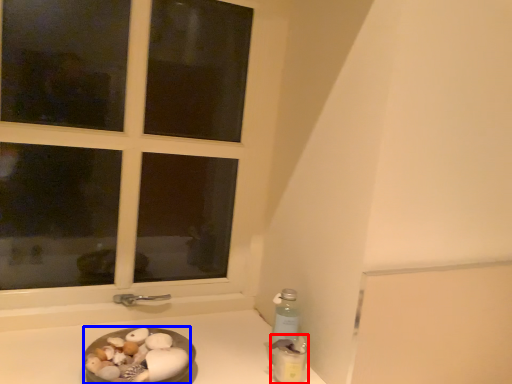
Question: Which point is closer to the camera, bottle (highlighted by a red box) or food (highlighted by a blue box)?

Choices:
 (A) bottle
 (B) food

Answer: (B)